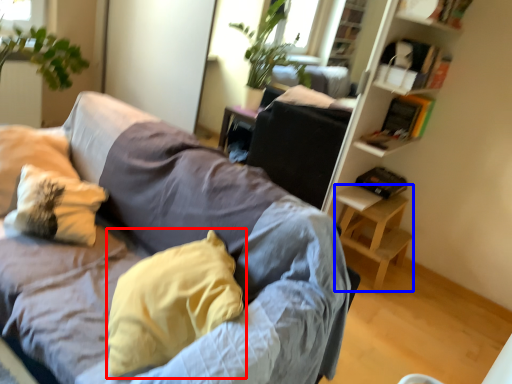
Question: Which object appears closest to the camera in this image, pillow (highlighted by a red box) or table (highlighted by a blue box)?

Choices:
 (A) pillow
 (B) table

Answer: (A)